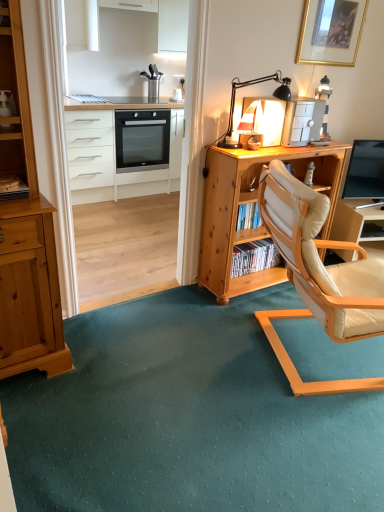
This screenshot has width=384, height=512. Identify the location of matte black tv at right. (365, 170).

Where is `white leather chair at lower right`? This screenshot has width=384, height=512. white leather chair at lower right is located at coordinates (357, 222).

In order to click on black metal table lamp at upper right in this screenshot , I will do `click(250, 85)`.

What do you see at coordinates (331, 32) in the screenshot? This screenshot has width=384, height=512. I see `gold-framed picture at upper right` at bounding box center [331, 32].

Locate an element on the screen. This screenshot has width=384, height=512. matte black tv at right is located at coordinates 365,170.

How many degrees apart are the facing directions of light wood desk at center and beige leather chair at center-right?

They differ by 65.4 degrees in their facing directions.

Consider the image. Looking at the image, does light wood desk at center seem bigger or smaller compared to beige leather chair at center-right?

Considering their sizes, light wood desk at center takes up less space than beige leather chair at center-right.

Is light wood desk at center to the left of beige leather chair at center-right from the viewer's perspective?

Yes, light wood desk at center is to the left of beige leather chair at center-right.

Does light wood desk at center touch beige leather chair at center-right?

They are not placed beside each other.

Is matte white lamp at upper center, which is the 1th appliance in left-to-right order, oriented towards beige leather chair at center-right?

No, matte white lamp at upper center, which is the 1th appliance in left-to-right order, is not aimed at beige leather chair at center-right.

Considering the positions of points (266, 110) and (273, 168), is point (266, 110) closer to camera compared to point (273, 168)?

No, (266, 110) is behind (273, 168).

From a real-world perspective, is matte white lamp at upper center, which is the 1th appliance in left-to-right order, physically below beige leather chair at center-right?

No, from a real-world perspective, matte white lamp at upper center, which is the 1th appliance in left-to-right order, is not beneath beige leather chair at center-right.

Is matte white lamp at upper center, placed as the 2th appliance when sorted from right to left, positioned beyond the bounds of beige leather chair at center-right?

That's correct, matte white lamp at upper center, placed as the 2th appliance when sorted from right to left, is outside of beige leather chair at center-right.

Is point (331, 20) farther from camera compared to point (259, 106)?

Yes, it is.

Is gold-framed picture at upper right smaller than matte white lamp at upper center, which is the 1th appliance in left-to-right order?

Yes.

From the image's perspective, is gold-framed picture at upper right on matte white lamp at upper center, placed as the 2th appliance when sorted from right to left?

Yes.

In terms of height, does gold-framed picture at upper right look taller or shorter compared to matte white lamp at upper center, placed as the 2th appliance when sorted from right to left?

gold-framed picture at upper right is taller than matte white lamp at upper center, placed as the 2th appliance when sorted from right to left.

Is black glass oven at center inside or outside of white leather chair at lower right?

black glass oven at center is not enclosed by white leather chair at lower right.

Is black glass oven at center to the right of white leather chair at lower right from the viewer's perspective?

Incorrect, black glass oven at center is not on the right side of white leather chair at lower right.

What are the coordinates of `oven above the white leather chair at lower right (from a real-world perspective)` in the screenshot? It's located at (142, 140).

Which object is wider, black metal table lamp at upper right or beige leather chair at center-right?

beige leather chair at center-right.

Does black metal table lamp at upper right turn towards beige leather chair at center-right?

No, black metal table lamp at upper right is not oriented towards beige leather chair at center-right.

Is black metal table lamp at upper right with beige leather chair at center-right?

black metal table lamp at upper right and beige leather chair at center-right are not in contact.

Does black metal table lamp at upper right appear on the right side of beige leather chair at center-right?

No, black metal table lamp at upper right is not to the right of beige leather chair at center-right.

Based on their sizes in the image, would you say white glossy chest of drawers at upper left is bigger or smaller than light wood desk at center?

Considering their sizes, white glossy chest of drawers at upper left takes up more space than light wood desk at center.

Would you say white glossy chest of drawers at upper left is a long distance from light wood desk at center?

Yes, white glossy chest of drawers at upper left is far from light wood desk at center.

How many degrees apart are the facing directions of white glossy chest of drawers at upper left and light wood desk at center?

0.209 degrees separate the facing orientations of white glossy chest of drawers at upper left and light wood desk at center.

Locate an element on the screen. This screenshot has height=512, width=384. chest of drawers behind the light wood desk at center is located at coordinates (115, 150).

Is matte black tv at right outside of white glossy chest of drawers at upper left?

That's correct, matte black tv at right is outside of white glossy chest of drawers at upper left.

Does matte black tv at right have a smaller size compared to white glossy chest of drawers at upper left?

Indeed, matte black tv at right has a smaller size compared to white glossy chest of drawers at upper left.

Does point (363, 181) appear closer or farther from the camera than point (111, 112)?

Point (363, 181) appears to be closer to the viewer than point (111, 112).

From a real-world perspective, between matte black tv at right and white glossy chest of drawers at upper left, who is vertically lower?

white glossy chest of drawers at upper left.

Identify the location of chair above the light wood desk at center (from a real-world perspective). This screenshot has height=512, width=384. pos(318,276).

Which appliance is the 2nd one when counting from the left side of the beige leather chair at center-right? Please provide its 2D coordinates.

[(266, 117)]

Which object lies further to the anchor point white leather chair at lower right, white glossy chest of drawers at upper left or matte white lamp at upper center, placed as the 2th appliance when sorted from right to left?

white glossy chest of drawers at upper left.

Looking at the image, which one is located closer to white leather chair at lower right, white fabric curtain at upper left or matte black tv at right?

matte black tv at right.

Which object lies nearer to the anchor point gold-framed picture at upper right, black metal table lamp at upper right or matte white lamp at upper center, which is the 1th appliance in left-to-right order?

black metal table lamp at upper right.

From the image, which object appears to be farther from white glossy chest of drawers at upper left, white leather chair at lower right or gold-framed picture at upper right?

The object further to white glossy chest of drawers at upper left is white leather chair at lower right.

Which object lies nearer to the anchor point gold-framed picture at upper right, black glass oven at center or black metal table lamp at upper right?

Based on the image, black metal table lamp at upper right appears to be nearer to gold-framed picture at upper right.

Estimate the real-world distances between objects in this image. Which object is further from black metal table lamp at upper right, white glossy chest of drawers at upper left or gold-framed picture at upper right?

white glossy chest of drawers at upper left lies further to black metal table lamp at upper right than the other object.

Based on their spatial positions, is white glossy chest of drawers at upper left or matte white lamp at upper center, which is the 1th appliance in left-to-right order, closer to light wood desk at center?

Answer: matte white lamp at upper center, which is the 1th appliance in left-to-right order, is positioned closer to the anchor light wood desk at center.

Based on their spatial positions, is white fabric curtain at upper left or light wood desk at center further from matte white lamp at upper center, placed as the 2th appliance when sorted from right to left?

Among the two, white fabric curtain at upper left is located further to matte white lamp at upper center, placed as the 2th appliance when sorted from right to left.

What are the coordinates of `table lamp between white glossy chest of drawers at upper left and white plastic printer at upper right, the first appliance viewed from the right` in the screenshot? It's located at tap(250, 85).

Image resolution: width=384 pixels, height=512 pixels. Identify the location of desk located between white fabric curtain at upper left and beige leather chair at center-right in the left-right direction. (252, 202).

At what (x,y) coordinates should I click in order to perform the action: click on desk between matte white lamp at upper center, which is the 1th appliance in left-to-right order, and white leather chair at lower right, in the horizontal direction. Please return your answer as a coordinate pair (x, y). The width and height of the screenshot is (384, 512). Looking at the image, I should click on (252, 202).

You are a GUI agent. You are given a task and a screenshot of the screen. Output one action in this format:
    pyautogui.click(x=<x>, y=<y>)
    Task: Click on the table lamp between white fabric curtain at upper left and white glossy chest of drawers at upper left in the front-back direction
    This screenshot has width=384, height=512.
    Given the screenshot: What is the action you would take?
    250,85